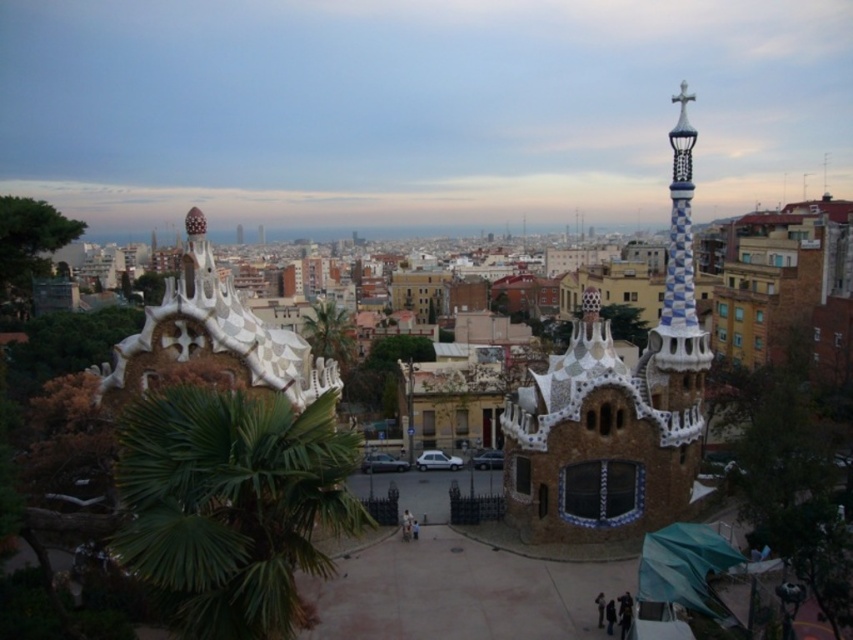
Question: Which is farther from the green leafy palm tree at center?

Choices:
 (A) checkerboard ceramic tower at center
 (B) green leafy palm at lower left

Answer: (B)

Question: Which object appears closest to the camera in this image?

Choices:
 (A) green leafy palm at lower left
 (B) green leafy palm tree at center

Answer: (A)

Question: Observing the image, what is the correct spatial positioning of green leafy palm at lower left in reference to checkerboard ceramic tower at center?

Choices:
 (A) right
 (B) left

Answer: (B)

Question: Does green leafy palm at lower left have a greater width compared to checkerboard ceramic tower at center?

Choices:
 (A) no
 (B) yes

Answer: (B)

Question: Considering the relative positions of green leafy palm at lower left and green leafy palm tree at center in the image provided, where is green leafy palm at lower left located with respect to green leafy palm tree at center?

Choices:
 (A) above
 (B) below

Answer: (B)

Question: Which object is positioned farthest from the green leafy palm tree at center?

Choices:
 (A) green leafy palm at lower left
 (B) checkerboard ceramic tower at center

Answer: (A)